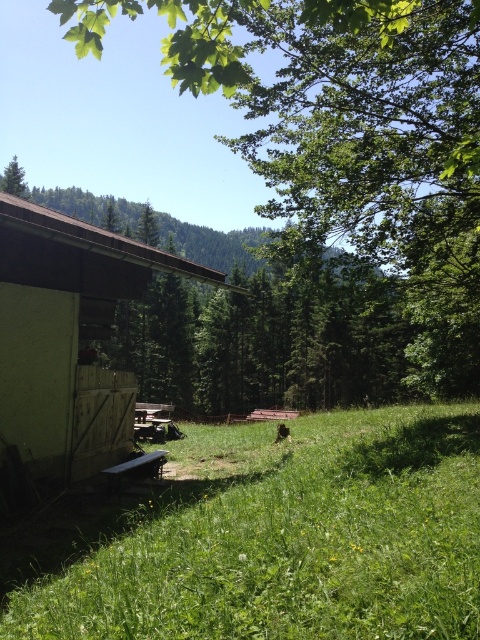
Question: Which is farther from the green grassy field at lower left?

Choices:
 (A) green matte tree at upper left
 (B) green leafy tree at upper left
 (C) wooden picnic table at lower center

Answer: (A)

Question: Where is wooden picnic table at lower center located in relation to green matte tree at upper left in the image?

Choices:
 (A) below
 (B) above

Answer: (A)

Question: Among these points, which one is farthest from the camera?

Choices:
 (A) (333, 112)
 (B) (33, 621)
 (C) (9, 180)

Answer: (C)

Question: Does green leafy tree at upper left appear under wooden picnic table at lower center?

Choices:
 (A) no
 (B) yes

Answer: (A)

Question: Which of these objects is positioned farthest from the green grassy field at lower left?

Choices:
 (A) green leafy tree at upper left
 (B) wooden picnic table at lower center
 (C) green matte tree at upper left

Answer: (C)

Question: Where is green leafy tree at upper left located in relation to green matte tree at upper left in the image?

Choices:
 (A) below
 (B) above

Answer: (A)